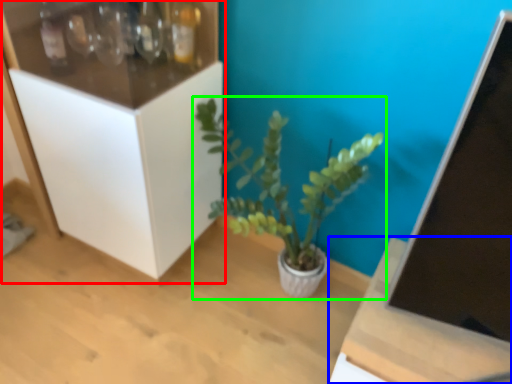
Question: Which is farther away from cabinetry (highlighted by a red box)? table (highlighted by a blue box) or houseplant (highlighted by a green box)?

Choices:
 (A) table
 (B) houseplant

Answer: (A)